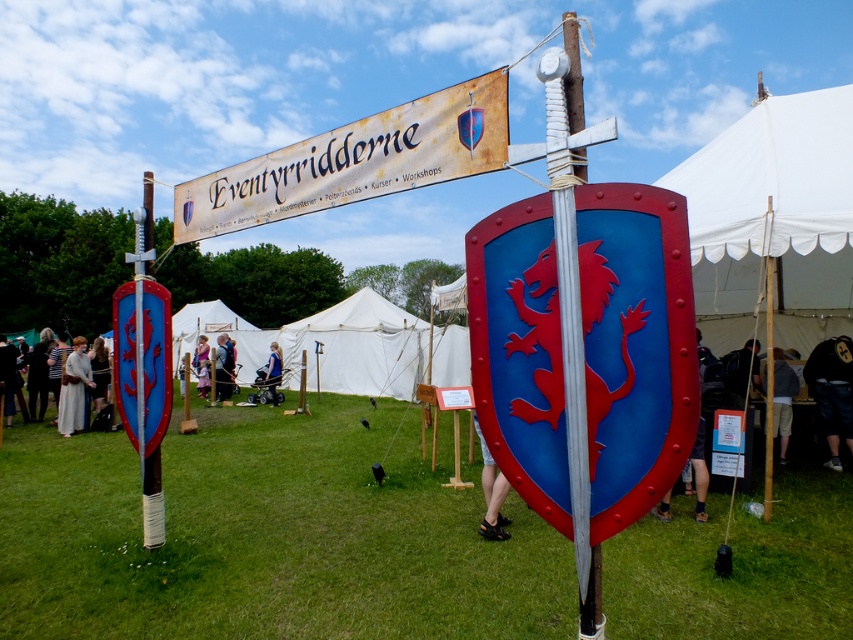
Can you confirm if smooth beige tunic at center is bigger than blue fabric dress at center?

Indeed, smooth beige tunic at center has a larger size compared to blue fabric dress at center.

The width and height of the screenshot is (853, 640). What are the coordinates of `smooth beige tunic at center` in the screenshot? It's located at (222, 369).

Which is behind, point (213, 362) or point (267, 364)?

The point (267, 364) is more distant.

Locate an element on the screen. This screenshot has width=853, height=640. smooth beige tunic at center is located at coordinates (222, 369).

Between blue fabric shorts at lower center and blue fabric dress at center, which one has less height?

blue fabric shorts at lower center is shorter.

Is blue fabric shorts at lower center below blue fabric dress at center?

Incorrect, blue fabric shorts at lower center is not positioned below blue fabric dress at center.

Where is `blue fabric shorts at lower center`? The width and height of the screenshot is (853, 640). blue fabric shorts at lower center is located at coordinates (491, 492).

This screenshot has width=853, height=640. What do you see at coordinates (833, 392) in the screenshot?
I see `black leather jacket at lower right` at bounding box center [833, 392].

Who is taller, black leather jacket at lower right or smooth beige tunic at center?

black leather jacket at lower right is taller.

What are the coordinates of `black leather jacket at lower right` in the screenshot? It's located at (833, 392).

Where is `black leather jacket at lower right`? black leather jacket at lower right is located at coordinates (833, 392).